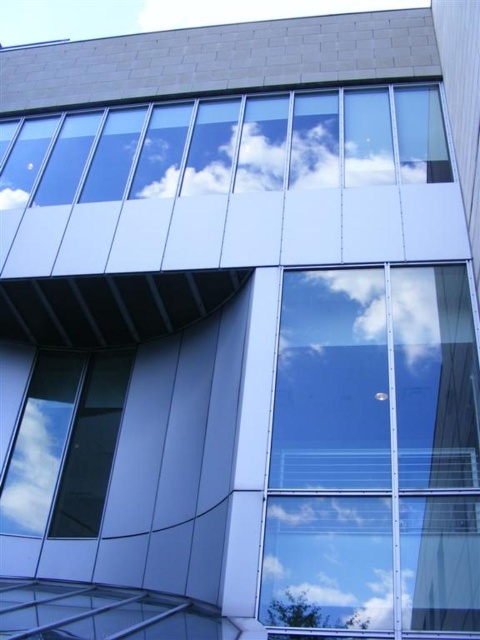
You are an architect reviewing the building facade and notice the transparent glass window at lower left and the white fluffy cloud at center. From your vantage point, which object is closer to you?

The transparent glass window at lower left is closer to you because the white fluffy cloud at center is behind it.

You are an architect reviewing the building design and need to place a new light fixture. The fixture requires a mounting point that is 0.8 meters above the transparent glass window at center. Where should you position the mounting point relative to the window?

The transparent glass window at center is located at point (374, 452). To place the mounting point 0.8 meters above it, you would position it at coordinates (374, 452) plus 0.8 meters vertically.

You are standing in front of the modern architectural facade and want to locate the point at coordinates point [64,445]. According to the scene description, where is this point located?

The point [64,445] is on transparent glass window at lower left.